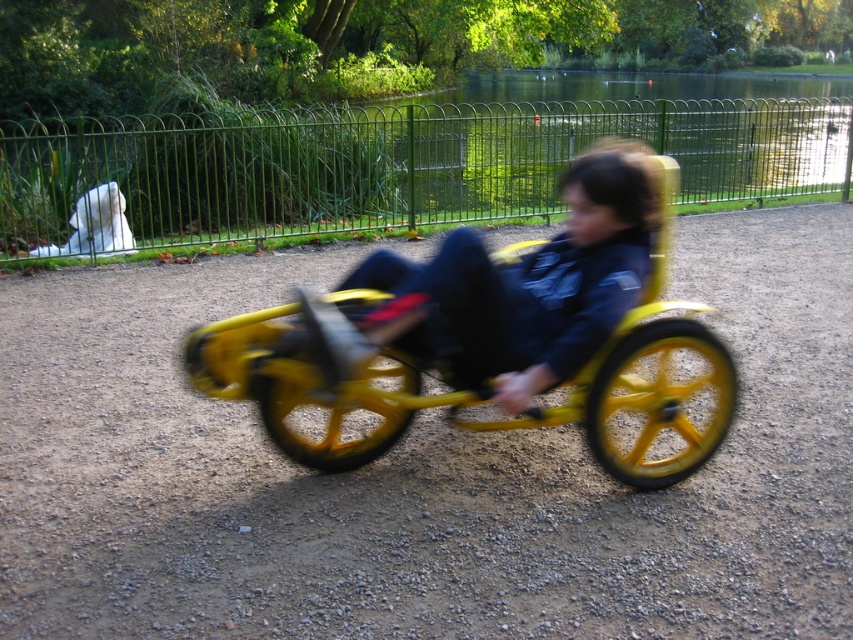
You are a parent watching your child play in the park. You see the yellow matte tricycle at center and the green metallic fence at upper center. Which object is shorter?

The yellow matte tricycle at center is shorter than the green metallic fence at upper center.

You are a drone operator trying to capture a photo of the child riding the tricycle. The drone is currently positioned above the green metallic fence at upper center. To get a clear shot of the child, should you move the drone north or south? Please explain your reasoning based on the fence location.

The green metallic fence at upper center is located at coordinates [631,84]. Since the child is on the gravel path, which is in front of the fence, moving the drone north would position it closer to the child, allowing for a clearer shot. Moving south would take it away from the child and towards the water beyond the fence.

You are a parent watching your child play in the park. You see the yellow matte tricycle at center and the white fur ghost at upper left. Which object is closer to you?

The yellow matte tricycle at center is closer to you because it is in front of the white fur ghost at upper left.